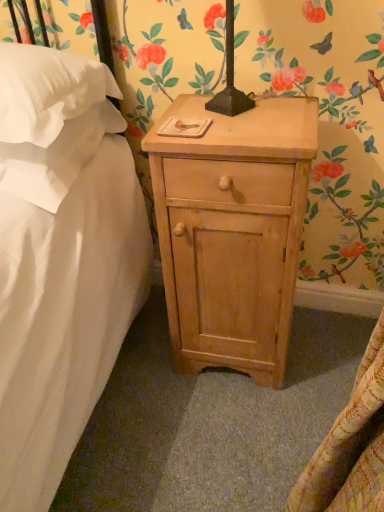
What are the coordinates of `vacant region to the left of natural wood nightstand at center` in the screenshot? It's located at (140, 386).